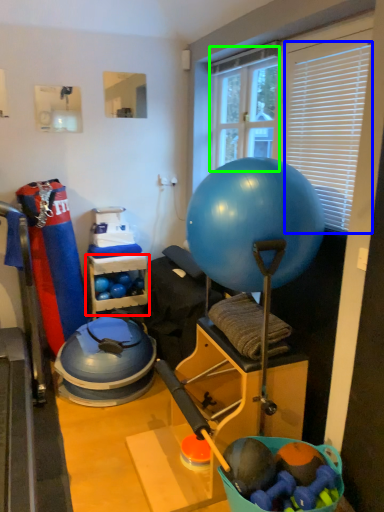
Question: Based on their relative distances, which object is farther from shelf (highlighted by a red box)? Choose from blind (highlighted by a blue box) and window screen (highlighted by a green box).

Choices:
 (A) blind
 (B) window screen

Answer: (A)